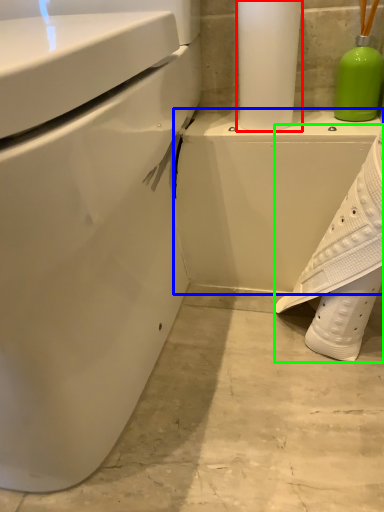
Question: Based on their relative distances, which object is nearer to paper towel (highlighted by a red box)? Choose from porcelain (highlighted by a blue box) and shoe (highlighted by a green box).

Choices:
 (A) porcelain
 (B) shoe

Answer: (A)